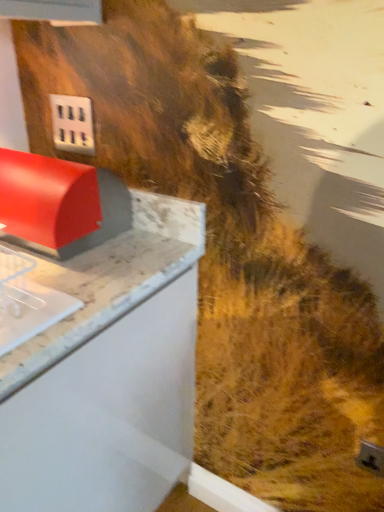
What are the coordinates of `white plastic electrical outlet at upper left` in the screenshot? It's located at (72, 124).

In order to face white plastic electrical outlet at upper left, should I rotate leftwards or rightwards?

Turn left by 16.063 degrees to look at white plastic electrical outlet at upper left.

Describe the element at coordinates (72, 124) in the screenshot. The image size is (384, 512). I see `white plastic electrical outlet at upper left` at that location.

Locate an element on the screen. This screenshot has height=512, width=384. white plastic electrical outlet at upper left is located at coordinates (72, 124).